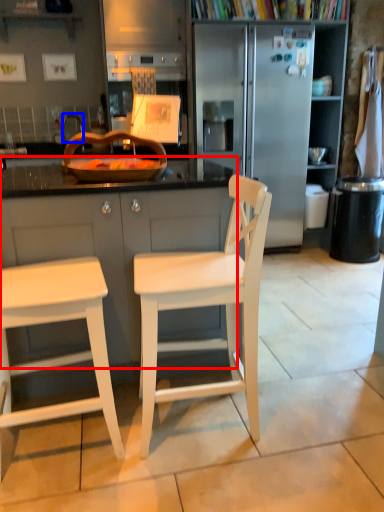
Question: Which object is further to the camera taking this photo, cabinetry (highlighted by a red box) or faucet (highlighted by a blue box)?

Choices:
 (A) cabinetry
 (B) faucet

Answer: (B)